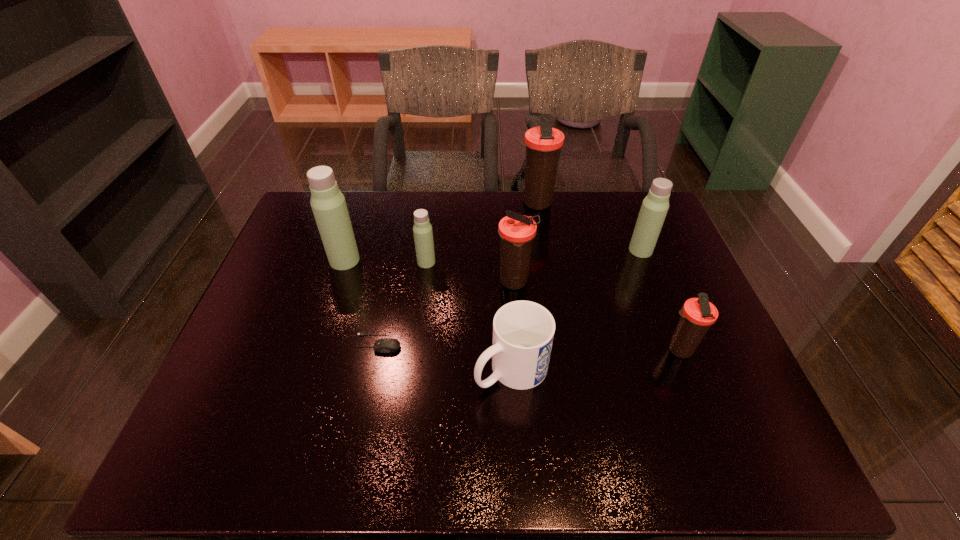
At what (x,y) coordinates should I click in order to perform the action: click on mug. Please return your answer as a coordinate pair (x, y). Image resolution: width=960 pixels, height=540 pixels. Looking at the image, I should click on (523, 331).

Find the location of a particular element. mouse is located at coordinates (384, 345).

I want to click on the shortest object, so click(x=384, y=345).

The height and width of the screenshot is (540, 960). What are the coordinates of `free region located 0.340m on the front of the biggest brown thermos bottle` in the screenshot? It's located at tap(548, 289).

At what (x,y) coordinates should I click in order to perform the action: click on free space located on the back of the leftmost light thermos bottle. Please return your answer as a coordinate pair (x, y). Looking at the image, I should click on (356, 224).

What are the coordinates of `vacant space located on the back of the second smallest brown thermos bottle` in the screenshot? It's located at (508, 192).

Find the location of a particular element. vacant space located 0.150m on the front of the rightmost light thermos bottle is located at coordinates (658, 295).

The height and width of the screenshot is (540, 960). In order to click on free point located on the right of the second light thermos bottle from right to left in this screenshot , I will do `click(493, 262)`.

Locate an element on the screen. The width and height of the screenshot is (960, 540). vacant region located 0.270m on the back of the nearest brown thermos bottle is located at coordinates 645,264.

The height and width of the screenshot is (540, 960). In order to click on free space located 0.310m on the back of the mug in this screenshot , I will do `click(505, 258)`.